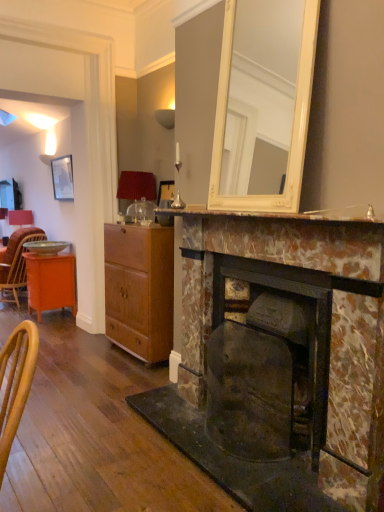
This screenshot has width=384, height=512. What do you see at coordinates (46, 246) in the screenshot? I see `metallic silver plate at left` at bounding box center [46, 246].

Locate an element on the screen. wooden wicker chair at left is located at coordinates (17, 262).

Describe the element at coordinates (17, 262) in the screenshot. I see `wooden wicker chair at left` at that location.

Describe the element at coordinates (283, 291) in the screenshot. I see `rusty metal fireplace at center, which appears as the first fireplace when viewed from the back` at that location.

Where is `marble mantelpiece at center`? marble mantelpiece at center is located at coordinates (271, 214).

Describe the element at coordinates (140, 289) in the screenshot. I see `wooden cabinet at center` at that location.

The width and height of the screenshot is (384, 512). What do you see at coordinates (50, 282) in the screenshot? I see `orange wood desk at left` at bounding box center [50, 282].

What are the coordinates of `matte red lampshade at center` in the screenshot? It's located at (136, 186).

Considering the sizes of objects marble fireplace at center, the 1th fireplace in the front-to-back sequence, and matte red lampshade at center in the image provided, who is wider, marble fireplace at center, the 1th fireplace in the front-to-back sequence, or matte red lampshade at center?

With larger width is marble fireplace at center, the 1th fireplace in the front-to-back sequence.

Is marble fireplace at center, placed as the 2th fireplace when sorted from back to front, oriented away from matte red lampshade at center?

No, marble fireplace at center, placed as the 2th fireplace when sorted from back to front,'s orientation is not away from matte red lampshade at center.

From a real-world perspective, who is located lower, marble fireplace at center, the 1th fireplace in the front-to-back sequence, or matte red lampshade at center?

marble fireplace at center, the 1th fireplace in the front-to-back sequence, is physically lower.

Considering the sizes of marble fireplace at center, the 1th fireplace in the front-to-back sequence, and matte red lampshade at center in the image, is marble fireplace at center, the 1th fireplace in the front-to-back sequence, taller or shorter than matte red lampshade at center?

Considering their sizes, marble fireplace at center, the 1th fireplace in the front-to-back sequence, has more height than matte red lampshade at center.

Considering the sizes of metallic silver plate at left and matte red lampshade at center in the image, is metallic silver plate at left wider or thinner than matte red lampshade at center?

Considering their sizes, metallic silver plate at left looks broader than matte red lampshade at center.

Considering the relative sizes of metallic silver plate at left and matte red lampshade at center in the image provided, is metallic silver plate at left taller than matte red lampshade at center?

Incorrect, the height of metallic silver plate at left is not larger of that of matte red lampshade at center.

Is metallic silver plate at left to the left or to the right of matte red lampshade at center in the image?

metallic silver plate at left is positioned on matte red lampshade at center's left side.

From the image's perspective, which one is positioned higher, metallic silver plate at left or matte red lampshade at center?

matte red lampshade at center, from the image's perspective.

This screenshot has width=384, height=512. In order to click on plate located above the marble fireplace at center, placed as the 2th fireplace when sorted from back to front (from a real-world perspective) in this screenshot , I will do (x=46, y=246).

From a real-world perspective, is metallic silver plate at left physically located above or below marble fireplace at center, the 1th fireplace in the front-to-back sequence?

metallic silver plate at left is above marble fireplace at center, the 1th fireplace in the front-to-back sequence.

Is metallic silver plate at left not inside marble fireplace at center, placed as the 2th fireplace when sorted from back to front?

metallic silver plate at left is positioned outside marble fireplace at center, placed as the 2th fireplace when sorted from back to front.

Can you confirm if metallic silver plate at left is smaller than marble fireplace at center, placed as the 2th fireplace when sorted from back to front?

Yes.

How far apart are metallic silver plate at left and wooden cabinet at center?

metallic silver plate at left and wooden cabinet at center are 1.52 meters apart from each other.

Which object is wider, metallic silver plate at left or wooden cabinet at center?

With larger width is metallic silver plate at left.

From the picture: Is metallic silver plate at left behind wooden cabinet at center?

Yes.

Between point (31, 244) and point (162, 241), which one is positioned in front?

The point (162, 241) is more forward.

Is matte red lampshade at center positioned far away from metallic silver plate at left?

Absolutely, matte red lampshade at center is distant from metallic silver plate at left.

Is matte red lampshade at center positioned with its back to metallic silver plate at left?

No, metallic silver plate at left is not at the back of matte red lampshade at center.

Is metallic silver plate at left completely or partially inside matte red lampshade at center?

No, metallic silver plate at left is not inside matte red lampshade at center.

Does point (165, 336) come in front of point (69, 243)?

Yes, point (165, 336) is closer to viewer.

From the image's perspective, between wooden cabinet at center and metallic silver plate at left, which one is located above?

metallic silver plate at left.

Are wooden cabinet at center and metallic silver plate at left far apart?

wooden cabinet at center is far away from metallic silver plate at left.

From a real-world perspective, which object stands above the other?

marble mantelpiece at center.

From the image's perspective, between marble mantelpiece at center and metallic silver plate at left, who is located below?

From the image's view, metallic silver plate at left is below.

Is marble mantelpiece at center oriented towards metallic silver plate at left?

No, marble mantelpiece at center is not oriented towards metallic silver plate at left.

Where is `lamp to the left of marble fireplace at center, placed as the 2th fireplace when sorted from back to front`? lamp to the left of marble fireplace at center, placed as the 2th fireplace when sorted from back to front is located at coordinates (136, 186).

The width and height of the screenshot is (384, 512). Find the location of `lamp located above the metallic silver plate at left (from a real-world perspective)`. lamp located above the metallic silver plate at left (from a real-world perspective) is located at coordinates (136, 186).

When comparing their distances from wooden wicker chair at left, does rusty metal fireplace at center, which appears as the first fireplace when viewed from the back, or matte red lampshade at center seem closer?

matte red lampshade at center is closer to wooden wicker chair at left.

From the image, which object appears to be farther from wooden cabinet at center, wooden wicker chair at left or matte black picture frame at upper left?

wooden wicker chair at left lies further to wooden cabinet at center than the other object.

When comparing their distances from wooden cabinet at center, does orange wood desk at left or matte red lampshade at center seem closer?

The object closer to wooden cabinet at center is matte red lampshade at center.

When comparing their distances from metallic silver plate at left, does orange wood desk at left or matte black picture frame at upper left seem further?

Among the two, matte black picture frame at upper left is located further to metallic silver plate at left.

Based on their spatial positions, is wooden cabinet at center or rusty metal fireplace at center, which appears as the first fireplace when viewed from the back, further from matte black picture frame at upper left?

The object further to matte black picture frame at upper left is rusty metal fireplace at center, which appears as the first fireplace when viewed from the back.

When comparing their distances from orange wood desk at left, does metallic silver plate at left or wooden cabinet at center seem further?

The object further to orange wood desk at left is wooden cabinet at center.

Which object lies further to the anchor point matte black picture frame at upper left, marble mantelpiece at center or orange wood desk at left?

The object further to matte black picture frame at upper left is marble mantelpiece at center.

Considering their positions, is matte red lampshade at center positioned closer to marble fireplace at center, placed as the 2th fireplace when sorted from back to front, than wooden wicker chair at left?

Based on the image, matte red lampshade at center appears to be nearer to marble fireplace at center, placed as the 2th fireplace when sorted from back to front.

In order to click on fireplace located between marble fireplace at center, the 1th fireplace in the front-to-back sequence, and orange wood desk at left in the depth direction in this screenshot , I will do `click(283, 291)`.

Find the location of a particular element. The height and width of the screenshot is (512, 384). lamp between marble fireplace at center, placed as the 2th fireplace when sorted from back to front, and orange wood desk at left, along the z-axis is located at coordinates (136, 186).

Identify the location of cabinetry between rusty metal fireplace at center, which appears as the first fireplace when viewed from the back, and wooden wicker chair at left from front to back. The width and height of the screenshot is (384, 512). (140, 289).

Where is `lamp between marble fireplace at center, the 1th fireplace in the front-to-back sequence, and matte black picture frame at upper left from front to back`? lamp between marble fireplace at center, the 1th fireplace in the front-to-back sequence, and matte black picture frame at upper left from front to back is located at coordinates (136, 186).